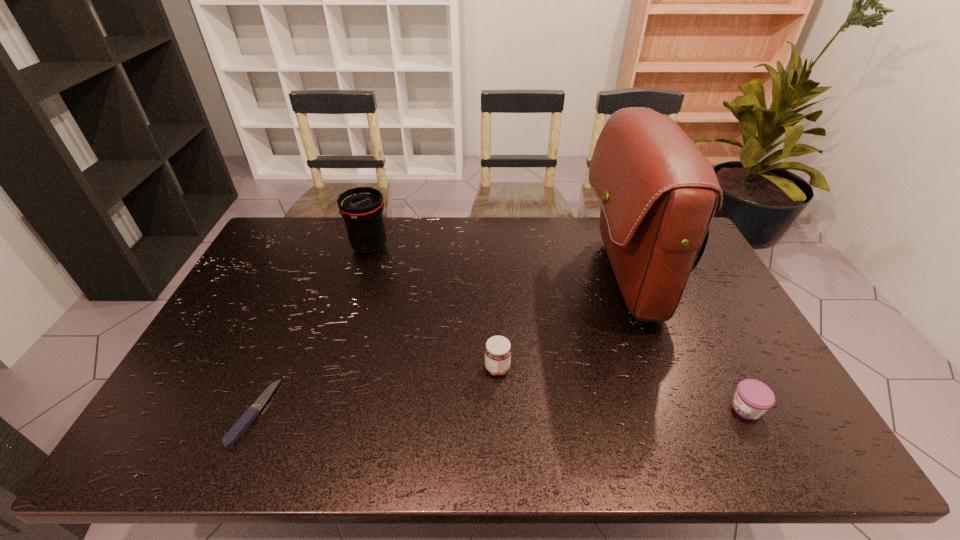
This screenshot has width=960, height=540. In order to click on the fourth object from left to right in this screenshot , I will do `click(658, 192)`.

At what (x,y) coordinates should I click in order to perform the action: click on the tallest object. Please return your answer as a coordinate pair (x, y). The width and height of the screenshot is (960, 540). Looking at the image, I should click on (658, 192).

Where is `telephoto lens`? telephoto lens is located at coordinates (361, 207).

What are the coordinates of `the second object from left to right` in the screenshot? It's located at (361, 207).

I want to click on the third object from left to right, so [498, 350].

I want to click on the taller jam, so click(x=498, y=350).

The height and width of the screenshot is (540, 960). Find the location of `the right jam`. the right jam is located at coordinates (752, 399).

Image resolution: width=960 pixels, height=540 pixels. Find the location of `the fourth tallest object`. the fourth tallest object is located at coordinates (752, 399).

The height and width of the screenshot is (540, 960). In order to click on the shortest object in this screenshot , I will do `click(239, 428)`.

Find the location of a particular element. The width and height of the screenshot is (960, 540). steak knife is located at coordinates (239, 428).